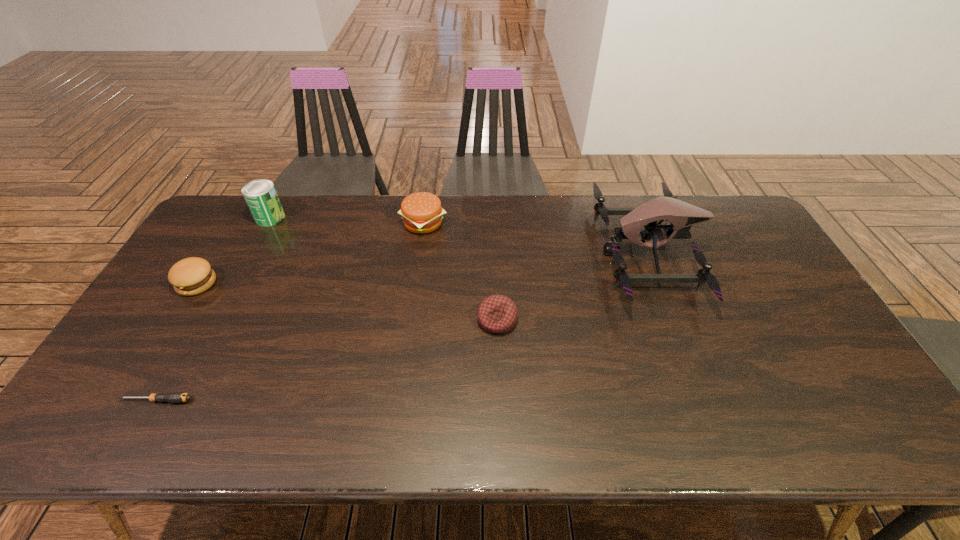
Where is `drone`? This screenshot has height=540, width=960. drone is located at coordinates (681, 215).

Where is `the tallest object`? Image resolution: width=960 pixels, height=540 pixels. the tallest object is located at coordinates (681, 215).

Image resolution: width=960 pixels, height=540 pixels. In order to click on the second tallest object in this screenshot , I will do `click(261, 197)`.

The height and width of the screenshot is (540, 960). I want to click on the third object from right to left, so click(x=421, y=212).

Find the location of a particular element. the taller hamburger is located at coordinates (421, 212).

You are a GUI agent. You are given a task and a screenshot of the screen. Output one action in this format:
    pyautogui.click(x=<x>, y=<y>)
    Task: Click on the shorter hamburger
    
    Given the screenshot: What is the action you would take?
    pyautogui.click(x=190, y=276)

This screenshot has width=960, height=540. Identify the location of the nearer hamburger. (190, 276).

The image size is (960, 540). Identify the location of the fifth object from left to right. (497, 314).

Find the location of a particular element. Image resolution: width=960 pixels, height=540 pixels. screwdriver is located at coordinates (173, 397).

Identify the location of the shortest object. The height and width of the screenshot is (540, 960). (173, 397).